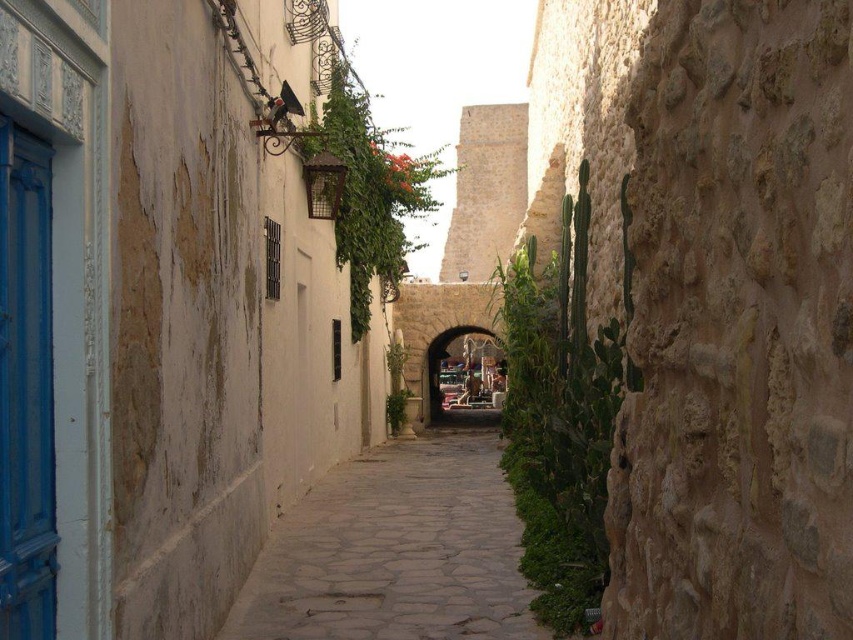
You are standing at the entrance of the alleyway and notice two points marked in the image. Which point, point (363,465) or point (469,365), is closer to you?

Point (363,465) is closer to the viewer than point (469,365).

You are a delivery person with a cart that is 1.2 meters wide. You need to navigate through the narrow alleyway shown in the image. Can your cart fit through the space between the pebble stone path at center and the stone archway at center?

The pebble stone path at center is smaller than the stone archway at center, so the space between them may be too narrow for your 1.2 meter wide cart. You should check the actual width before proceeding.

From the picture: You are a delivery drone with a maximum flight height of 1 meter. You need to fly through the alleyway shown in the image to deliver a package. The alleyway has a pebble stone path at center and a stone archway at center. Can you safely pass through the alleyway without hitting the walls or the archway?

The pebble stone path at center and stone archway at center are 88.74 meters apart. Since the drone has a maximum flight height of 1 meter and the alleyway is narrow, the vertical clearance under the stone archway at center must be at least 1 meter for safe passage. However, the provided information does not specify the height of the archway, so it is uncertain if the drone can pass safely.